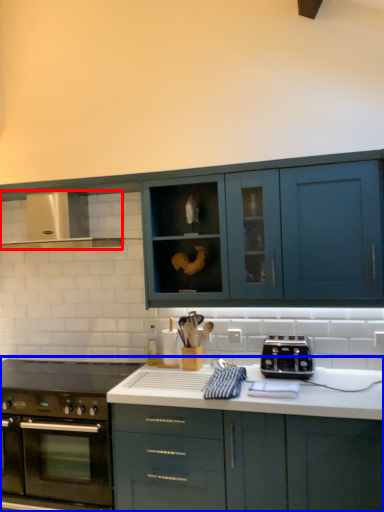
Question: Which object appears farthest to the camera in this image, exhaust hood (highlighted by a red box) or cabinetry (highlighted by a blue box)?

Choices:
 (A) exhaust hood
 (B) cabinetry

Answer: (A)